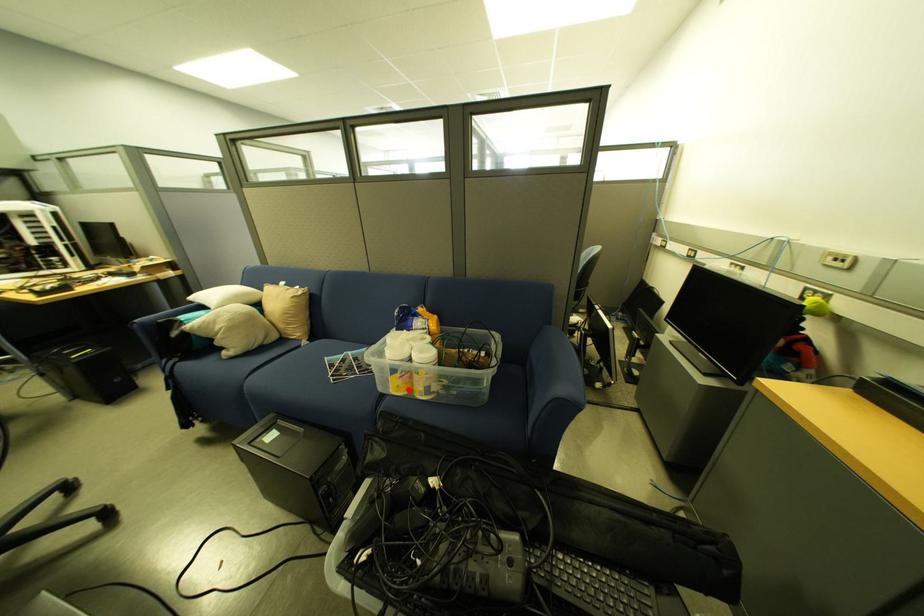
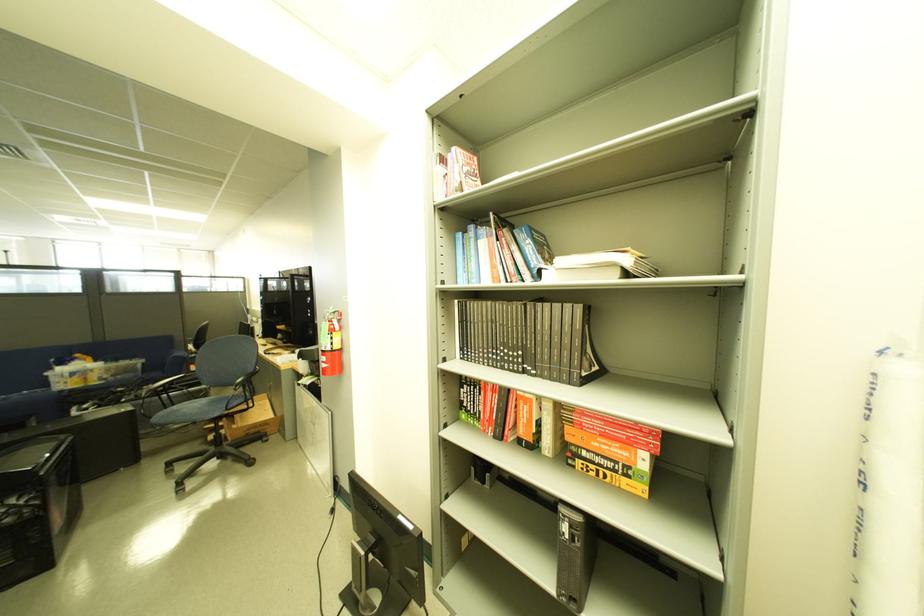
The point at the highlighted location is marked in the first image. Where is the corresponding point in the second image?

(88, 385)